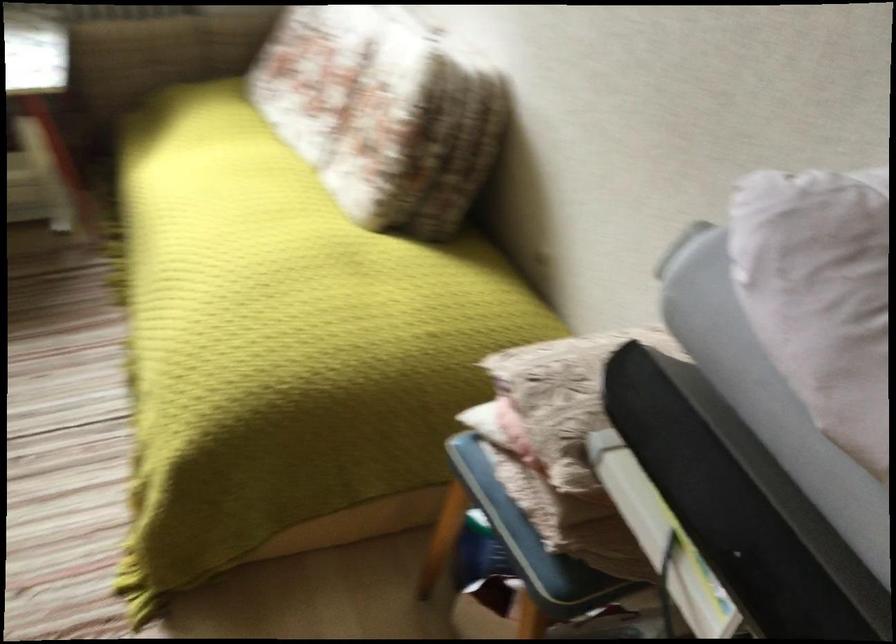
What do you see at coordinates (528, 534) in the screenshot? I see `the chair sitting surface` at bounding box center [528, 534].